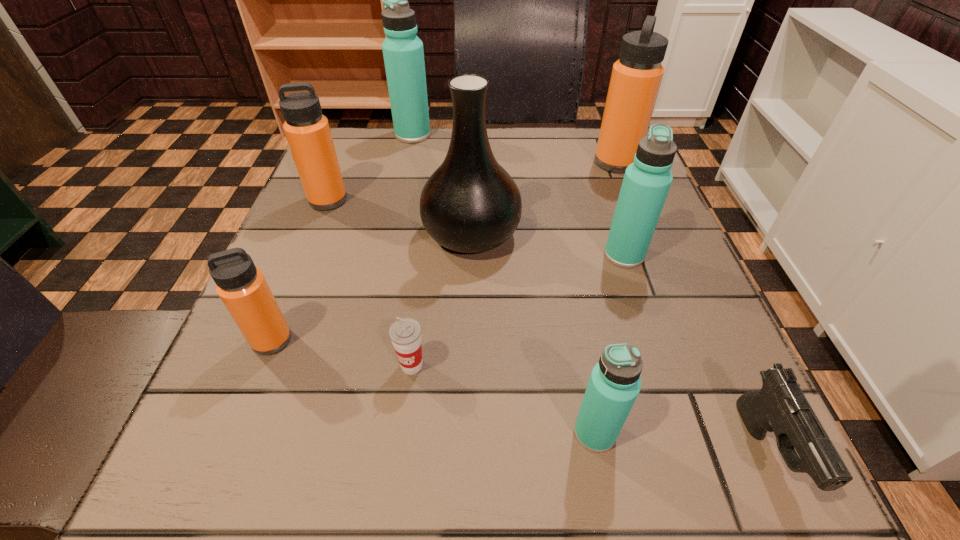
You are a GUI agent. You are given a task and a screenshot of the screen. Output one action in this format:
    pyautogui.click(x=<x>, y=<y>)
    Task: Click on the vacant space located on the back of the smallest aqua thermos bottle
    This screenshot has height=540, width=960.
    Given the screenshot: What is the action you would take?
    (x=560, y=247)

Where is `vacant position located on the back of the smallest orange thermos bottle`? vacant position located on the back of the smallest orange thermos bottle is located at coordinates (316, 230).

Where is `vacant region located on the side of the cup with the logo`? Image resolution: width=960 pixels, height=540 pixels. vacant region located on the side of the cup with the logo is located at coordinates (398, 473).

Where is `thermos bottle positioned at the near edge`? Image resolution: width=960 pixels, height=540 pixels. thermos bottle positioned at the near edge is located at coordinates pos(614,384).

What are the coordinates of `pistol that is at the near edge` in the screenshot? It's located at (780, 406).

Identify the location of pistol at the right edge. (780, 406).

Where is `object that is positioned at the far left corner`? This screenshot has width=960, height=540. object that is positioned at the far left corner is located at coordinates (403, 53).

At what (x,y) coordinates should I click in order to perform the action: click on object that is at the far right corner. Please return your answer as a coordinate pair (x, y). This screenshot has width=960, height=540. Looking at the image, I should click on (636, 77).

Identify the location of object that is positioned at the near right corner. This screenshot has width=960, height=540. (780, 406).

In the image, there is a desktop. In order to click on free space at the far edge in this screenshot , I will do `click(515, 143)`.